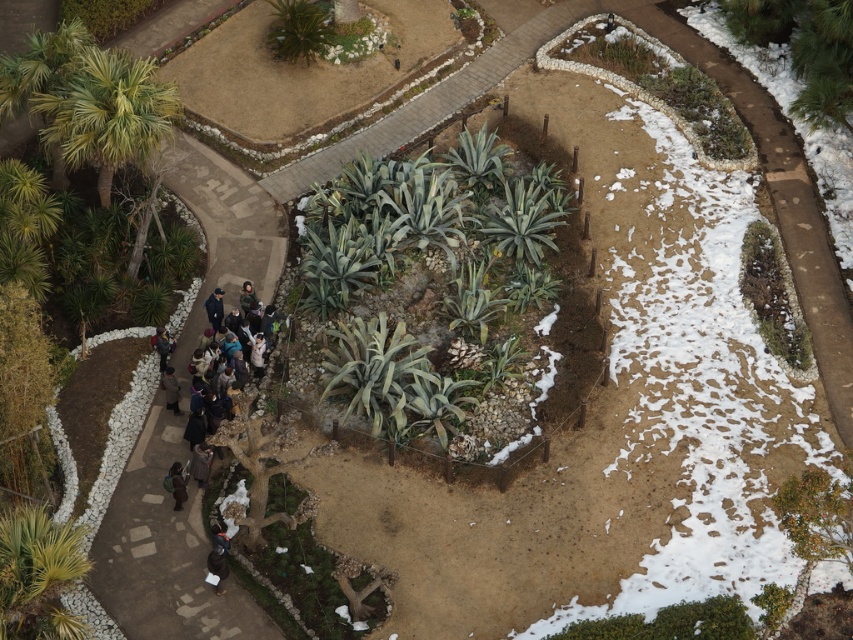
Question: Which point appears closest to the camera in this image?

Choices:
 (A) (166, 340)
 (B) (125, 520)
 (C) (132, 470)
 (D) (180, 490)

Answer: (B)

Question: Can you confirm if brown dirt path at center is positioned below dark gray jacket at center?

Choices:
 (A) yes
 (B) no

Answer: (B)

Question: Which object is closer to the camera taking this photo?

Choices:
 (A) dark blue jacket at center
 (B) dark gray jacket at lower left
 (C) brown dirt path at center

Answer: (C)

Question: Which point is closer to the camera?

Choices:
 (A) (167, 406)
 (B) (157, 348)
 (C) (209, 316)
 (D) (193, 472)

Answer: (D)

Question: Where is dark gray jacket at center located in relation to dark brown leather jacket at lower left in the image?

Choices:
 (A) left
 (B) right

Answer: (B)

Question: Does dark gray jacket at center have a greater width compared to dark brown coat at center-left?

Choices:
 (A) yes
 (B) no

Answer: (A)